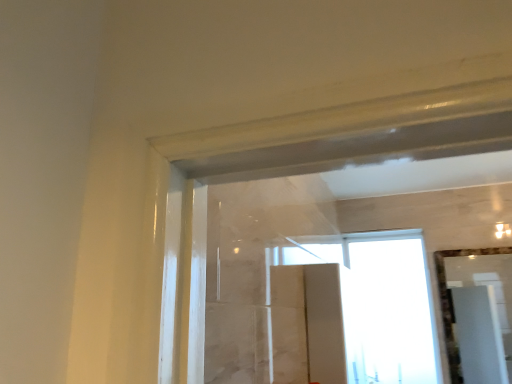
Question: Is transparent glass window at upper center turned away from clear glass mirror at upper right?

Choices:
 (A) yes
 (B) no

Answer: (B)

Question: Is transparent glass window at upper center at the right side of clear glass mirror at upper right?

Choices:
 (A) no
 (B) yes

Answer: (A)

Question: Is clear glass mirror at upper right located within transparent glass window at upper center?

Choices:
 (A) no
 (B) yes

Answer: (A)

Question: Is transparent glass window at upper center positioned far away from clear glass mirror at upper right?

Choices:
 (A) yes
 (B) no

Answer: (A)

Question: Considering the relative sizes of transparent glass window at upper center and clear glass mirror at upper right in the image provided, is transparent glass window at upper center smaller than clear glass mirror at upper right?

Choices:
 (A) no
 (B) yes

Answer: (A)

Question: Does transparent glass window at upper center have a lesser width compared to clear glass mirror at upper right?

Choices:
 (A) no
 (B) yes

Answer: (A)

Question: Is the depth of clear glass mirror at upper right greater than that of transparent glass window at upper center?

Choices:
 (A) no
 (B) yes

Answer: (A)

Question: Considering the relative sizes of clear glass mirror at upper right and transparent glass window at upper center in the image provided, is clear glass mirror at upper right thinner than transparent glass window at upper center?

Choices:
 (A) no
 (B) yes

Answer: (B)

Question: Can you confirm if clear glass mirror at upper right is positioned to the left of transparent glass window at upper center?

Choices:
 (A) yes
 (B) no

Answer: (B)

Question: Does clear glass mirror at upper right appear on the right side of transparent glass window at upper center?

Choices:
 (A) no
 (B) yes

Answer: (B)

Question: Considering the relative sizes of clear glass mirror at upper right and transparent glass window at upper center in the image provided, is clear glass mirror at upper right wider than transparent glass window at upper center?

Choices:
 (A) yes
 (B) no

Answer: (B)

Question: Is clear glass mirror at upper right far away from transparent glass window at upper center?

Choices:
 (A) yes
 (B) no

Answer: (A)

Question: Relative to clear glass mirror at upper right, is transparent glass window at upper center in front or behind?

Choices:
 (A) front
 (B) behind

Answer: (B)